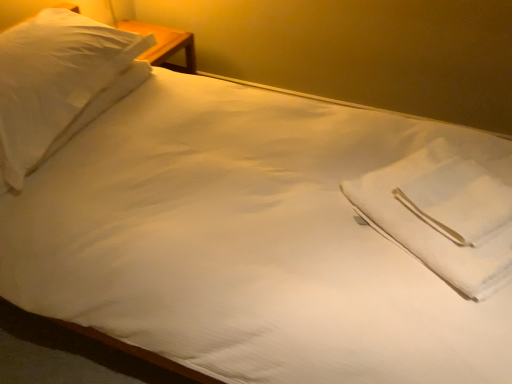
Question: From a real-world perspective, is white cotton cloth at center under white soft pillow at upper left?

Choices:
 (A) yes
 (B) no

Answer: (B)

Question: Is white soft pillow at upper left at the back of white cotton cloth at center?

Choices:
 (A) yes
 (B) no

Answer: (B)

Question: Is white cotton cloth at center bigger than white soft pillow at upper left?

Choices:
 (A) yes
 (B) no

Answer: (B)

Question: Is white soft pillow at upper left a part of white cotton cloth at center?

Choices:
 (A) yes
 (B) no

Answer: (B)

Question: Is white cotton cloth at center further to camera compared to white soft pillow at upper left?

Choices:
 (A) yes
 (B) no

Answer: (B)

Question: Is white cotton cloth at center touching white soft pillow at upper left?

Choices:
 (A) yes
 (B) no

Answer: (B)

Question: From a real-world perspective, is white soft pillow at upper left over white cotton cloth at center?

Choices:
 (A) no
 (B) yes

Answer: (A)

Question: Can you confirm if white soft pillow at upper left is positioned to the right of white cotton cloth at center?

Choices:
 (A) no
 (B) yes

Answer: (A)

Question: From the image's perspective, does white soft pillow at upper left appear lower than white cotton cloth at center?

Choices:
 (A) yes
 (B) no

Answer: (B)

Question: Does white soft pillow at upper left appear on the left side of white cotton cloth at center?

Choices:
 (A) no
 (B) yes

Answer: (B)

Question: Is white soft pillow at upper left positioned with its back to white cotton cloth at center?

Choices:
 (A) yes
 (B) no

Answer: (B)

Question: From a real-world perspective, is white soft pillow at upper left under white cotton cloth at center?

Choices:
 (A) no
 (B) yes

Answer: (B)

Question: From the image's perspective, relative to white cotton cloth at center, is white soft pillow at upper left above or below?

Choices:
 (A) above
 (B) below

Answer: (A)